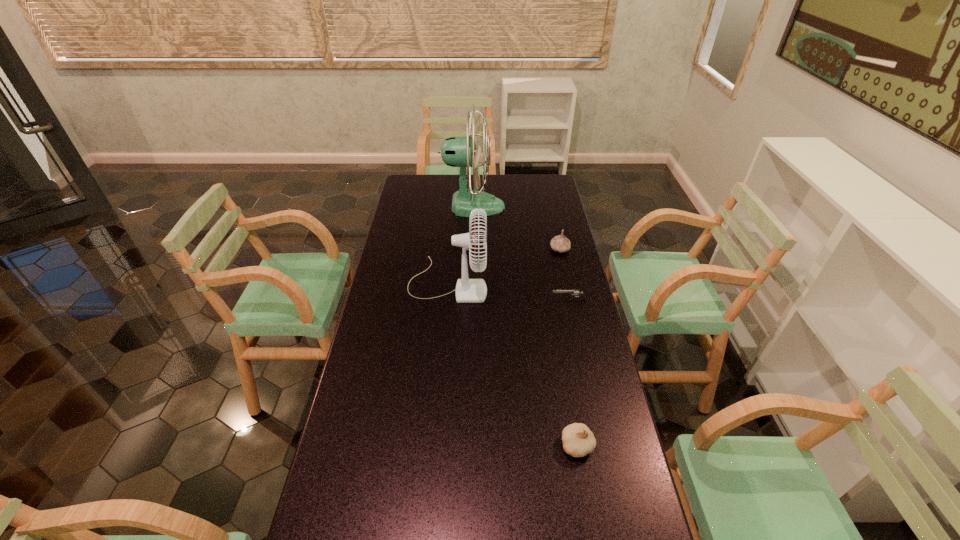
Identify the location of free space located 0.070m on the left of the farther garlic. This screenshot has width=960, height=540. (533, 249).

Locate an element on the screen. This screenshot has height=540, width=960. blank space located 0.370m on the left of the nearest object is located at coordinates (422, 446).

The width and height of the screenshot is (960, 540). I want to click on free space located on the front-facing side of the shortest object, so click(x=513, y=300).

This screenshot has width=960, height=540. What are the coordinates of `blank area located on the front-facing side of the shortest object` in the screenshot? It's located at (x=461, y=300).

Identify the location of vacant area situated on the front-facing side of the shortest object. (524, 300).

Image resolution: width=960 pixels, height=540 pixels. What are the coordinates of `object that is at the far edge` in the screenshot? It's located at (455, 151).

Image resolution: width=960 pixels, height=540 pixels. I want to click on object that is at the left edge, so click(x=467, y=290).

Locate an element on the screen. The width and height of the screenshot is (960, 540). pistol located in the right edge section of the desktop is located at coordinates (573, 292).

In the image, there is a desktop. Identify the location of vacant space at the far edge. (483, 174).

Identify the location of blank area at the left edge. (423, 202).